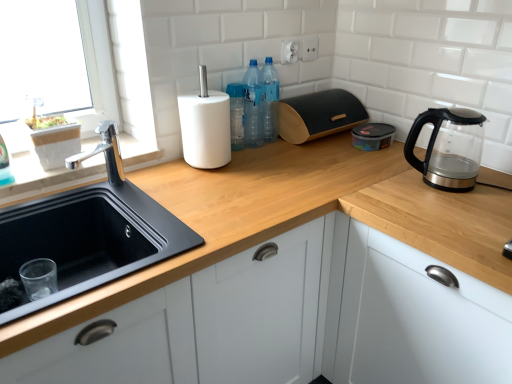
Locate an element on the screen. blank area to the left of chrome metallic faucet at left is located at coordinates (50, 193).